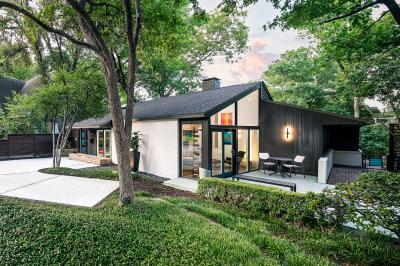
The width and height of the screenshot is (400, 266). Identify the location of lamp. (288, 132).